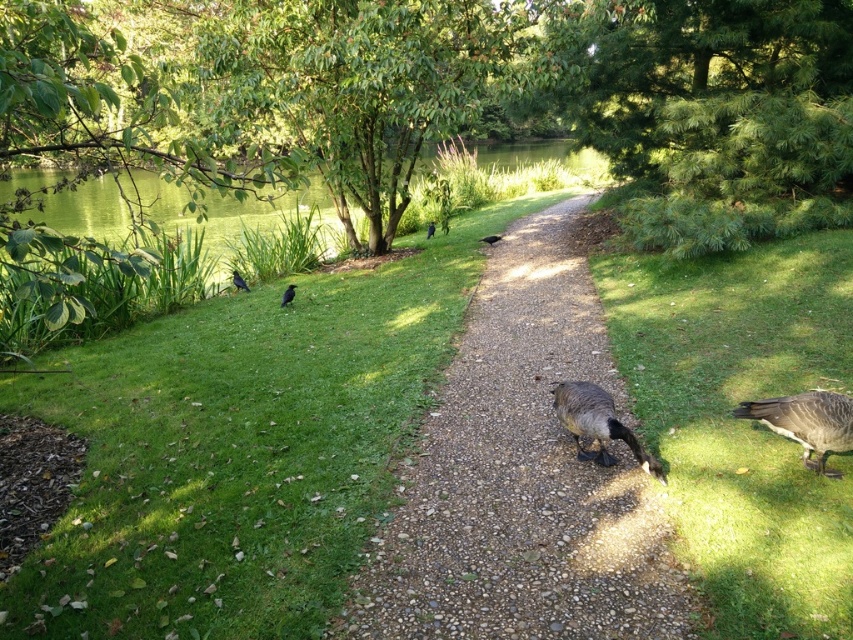
Question: Can you confirm if dark gray feathered duck at center is thinner than black glossy bird at center?

Choices:
 (A) no
 (B) yes

Answer: (A)

Question: Can you confirm if smooth gravel path at center is thinner than shiny black bird at left?

Choices:
 (A) yes
 (B) no

Answer: (B)

Question: Which is farther from the shiny black bird at center?

Choices:
 (A) black glossy bird at center
 (B) dark gray feathered duck at lower right

Answer: (B)

Question: Which object appears closest to the camera in this image?

Choices:
 (A) green grass at lower right
 (B) dark gray feathered duck at center

Answer: (B)

Question: Which object is the farthest from the shiny black bird at left?

Choices:
 (A) smooth gravel path at center
 (B) shiny black bird at center

Answer: (A)

Question: Is the position of dark gray feathered duck at center less distant than that of shiny black bird at center left?

Choices:
 (A) yes
 (B) no

Answer: (A)